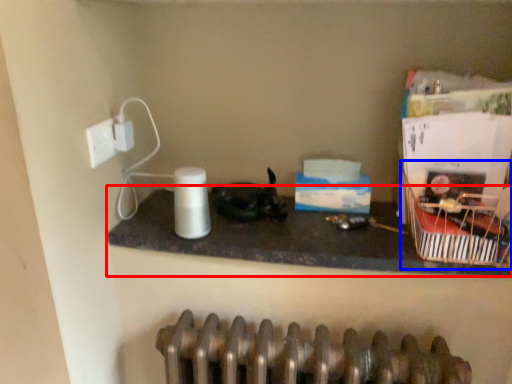
Question: Which object is closer to the camera taking this photo, counter top (highlighted by a red box) or basket (highlighted by a blue box)?

Choices:
 (A) counter top
 (B) basket

Answer: (B)